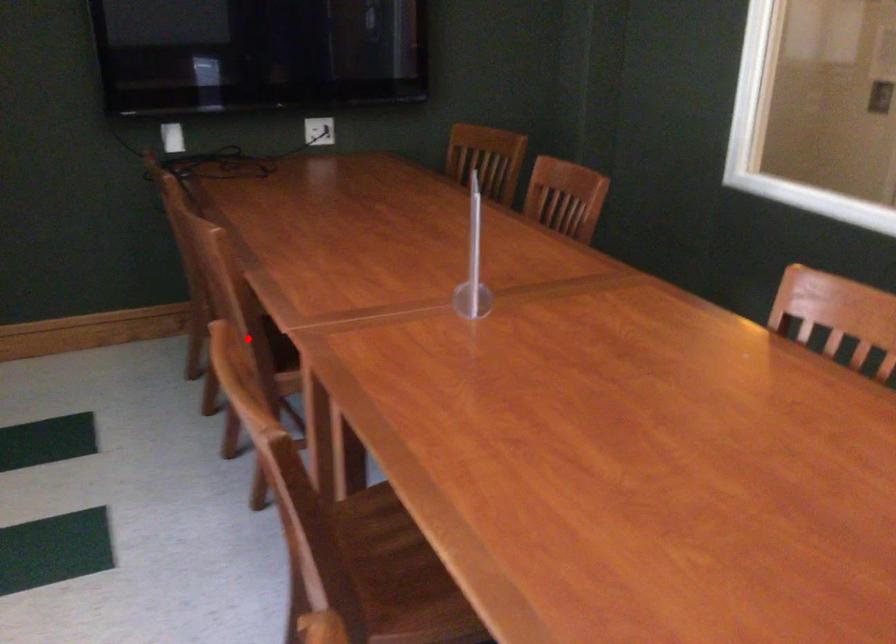
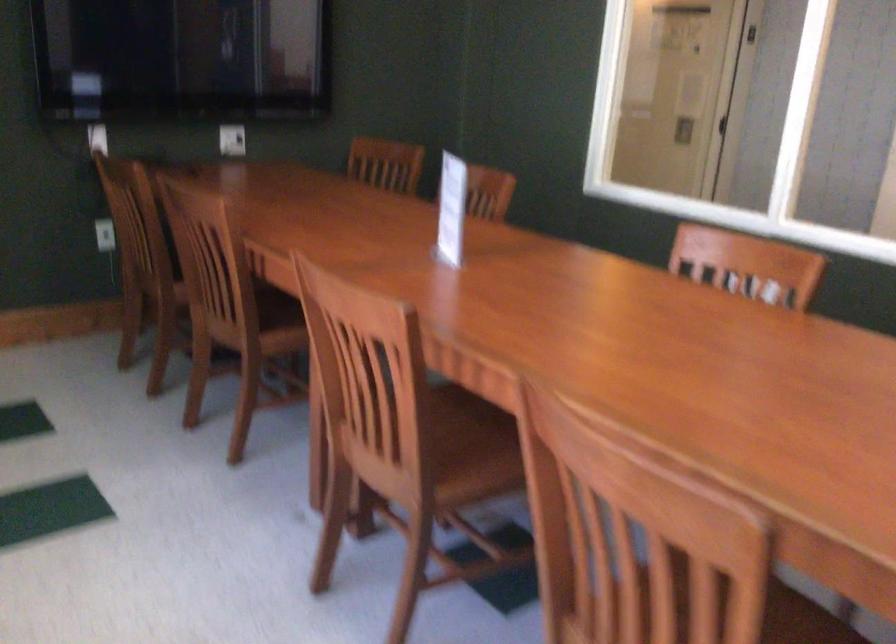
Where in the second image is the point corresponding to the highlighted location from the first image?

(239, 303)